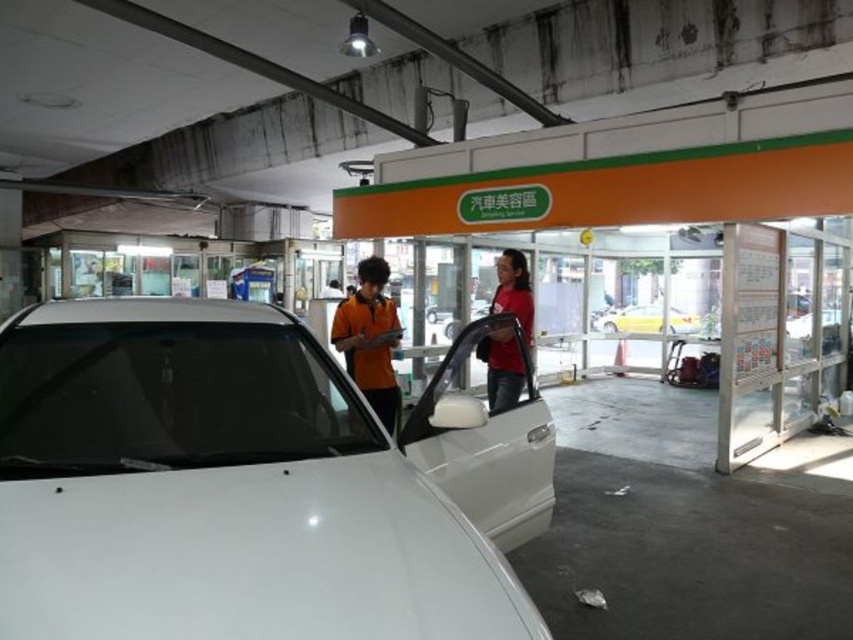
Looking at this image, you are standing in the car wash scene described. There is a point marked at coordinates (219, 488). What object does this point correspond to?

The point at coordinates (219, 488) corresponds to the white glossy car at center.

You are standing in a car wash station and want to clean the white glossy car at center. If your cleaning spray can reach up to 1.5 meters, will you be able to reach the car without moving closer?

The white glossy car at center is 1.28 meters from viewer, so yes, the spray can reach it since it is within the 1.5 meters range.

You are standing at the entrance of the car wash and want to locate the person wearing the orange matte shirt at center. According to the coordinates provided, which direction should you look to find them?

The orange matte shirt at center is located at coordinates point (370,339), so you should look towards the center of the scene to find them.